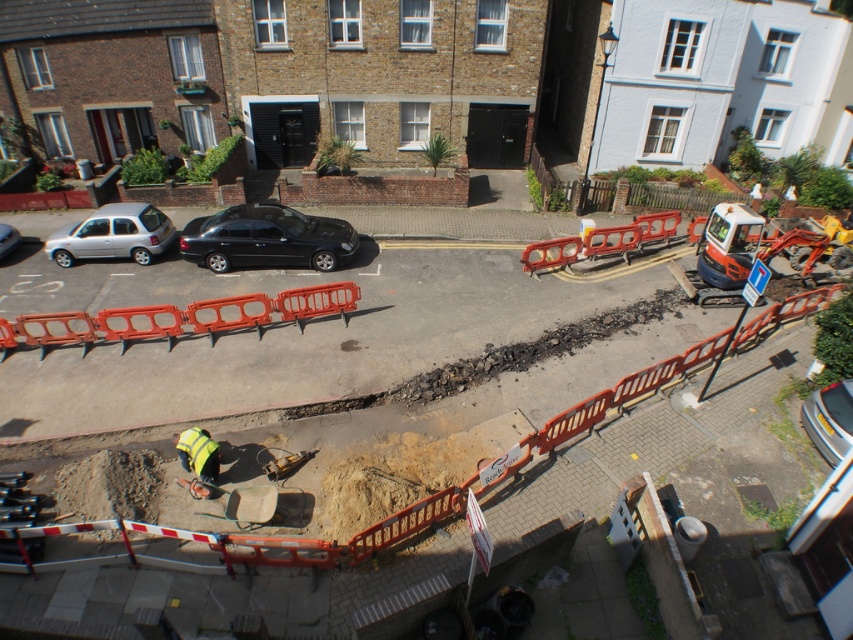
You are a pedestrian standing at the edge of the roadwork area. You see a black glossy sedan at center and a silver metallic hatchback at left. Which vehicle is nearer to you?

The black glossy sedan at center is closer to the viewer than the silver metallic hatchback at left, so the black glossy sedan at center is nearer to you.

You are a delivery driver approaching this construction zone. You need to know if there is enough space between the orange plastic barricade at center and the reflective yellow vest at center to safely pass through with your truck. Can you determine this based on their sizes?

The orange plastic barricade at center is smaller than the reflective yellow vest at center, but without knowing the exact dimensions of the truck or the distance between them, it is impossible to determine if there is enough space to safely pass through.